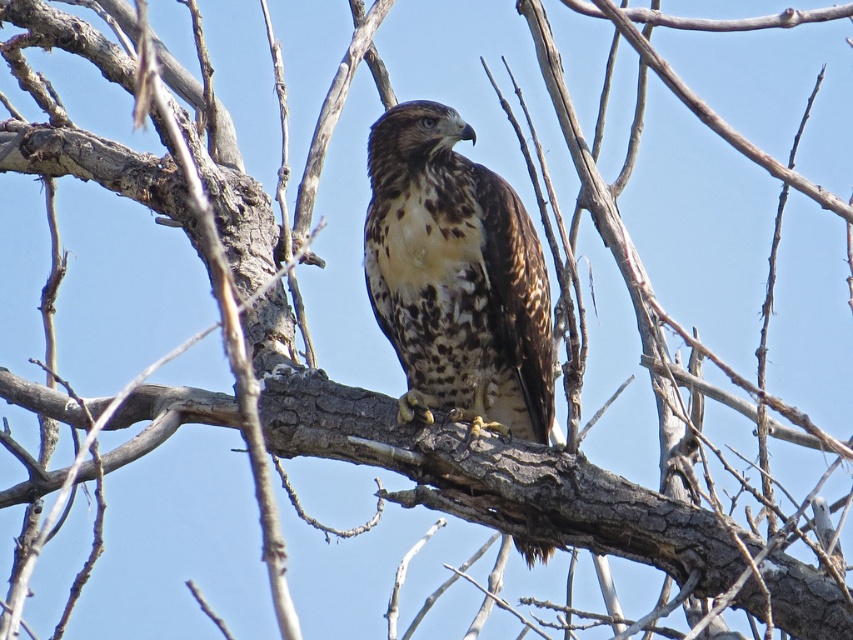
Question: Is brown speckled eagle at center bigger than brown speckled hawk at center?

Choices:
 (A) yes
 (B) no

Answer: (A)

Question: Is brown speckled eagle at center to the left of brown speckled hawk at center from the viewer's perspective?

Choices:
 (A) no
 (B) yes

Answer: (B)

Question: Is brown speckled eagle at center to the left of brown speckled hawk at center from the viewer's perspective?

Choices:
 (A) yes
 (B) no

Answer: (A)